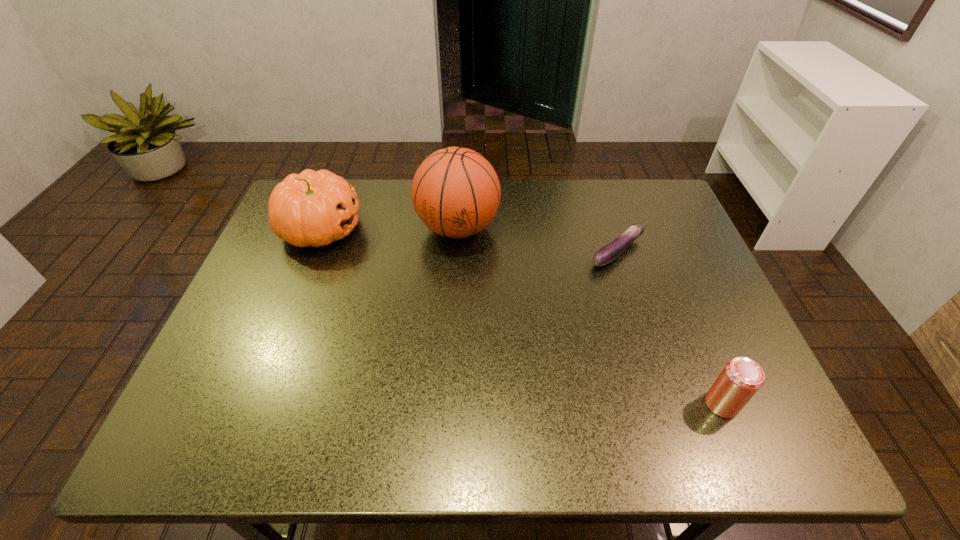
Image resolution: width=960 pixels, height=540 pixels. Find the location of `vacant area that lies between the shortest object and the second shortest object`. vacant area that lies between the shortest object and the second shortest object is located at coordinates (670, 328).

Locate an element on the screen. unoccupied position between the third shortest object and the beer can is located at coordinates (521, 316).

The height and width of the screenshot is (540, 960). Find the location of `unoccupied area between the basketball and the shortest object`. unoccupied area between the basketball and the shortest object is located at coordinates (538, 240).

Find the location of a particular element. free spot between the leftmost object and the eggplant is located at coordinates (469, 240).

This screenshot has height=540, width=960. I want to click on object that ranks as the second closest to the beer can, so click(x=455, y=192).

Identify the location of object that is the third closest to the beer can. The image size is (960, 540). (313, 208).

Where is `vacant space that satisfies the following two spatial constraints: 1. on the front side of the basketball; 2. on the carved face of the leftmost object`? vacant space that satisfies the following two spatial constraints: 1. on the front side of the basketball; 2. on the carved face of the leftmost object is located at coordinates (458, 228).

At what (x,y) coordinates should I click in order to perform the action: click on free point that satisfies the following two spatial constraints: 1. on the carved face of the shortest object; 2. on the left side of the third shortest object. Please return your answer as a coordinate pair (x, y). Image resolution: width=960 pixels, height=540 pixels. Looking at the image, I should click on pyautogui.click(x=312, y=252).

Identify the location of free spot that satisfies the following two spatial constraints: 1. on the carved face of the eggplant; 2. on the right side of the leftmost object. This screenshot has width=960, height=540. (312, 252).

Where is `vacant space that satisfies the following two spatial constraints: 1. on the carved face of the leftmost object; 2. on the right side of the second shortest object`? vacant space that satisfies the following two spatial constraints: 1. on the carved face of the leftmost object; 2. on the right side of the second shortest object is located at coordinates (252, 403).